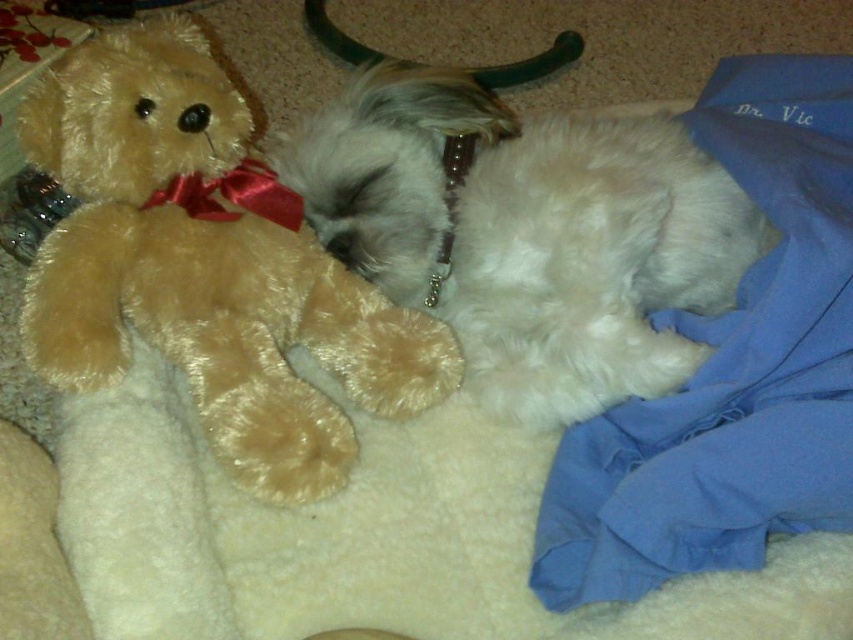
Question: Which of the following is the closest to the observer?

Choices:
 (A) (83, 349)
 (B) (642, 125)

Answer: (A)

Question: Can you confirm if soft brown plush bear at left is wider than white fluffy dog at center?

Choices:
 (A) yes
 (B) no

Answer: (B)

Question: Where is soft brown plush bear at left located in relation to white fluffy dog at center in the image?

Choices:
 (A) below
 (B) above

Answer: (A)

Question: Which point appears farthest from the camera in this image?

Choices:
 (A) (469, 292)
 (B) (369, 348)

Answer: (A)

Question: Which of the following is the closest to the observer?

Choices:
 (A) (496, 397)
 (B) (322, 248)

Answer: (A)

Question: Does soft brown plush bear at left appear over white fluffy dog at center?

Choices:
 (A) yes
 (B) no

Answer: (B)